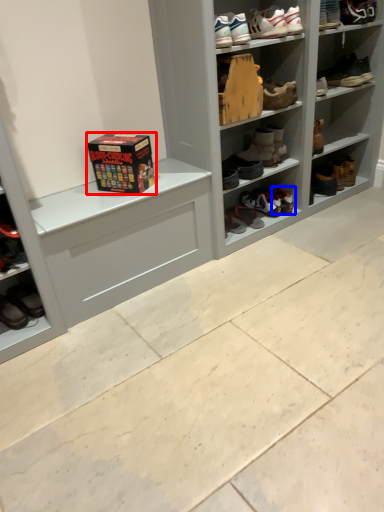
Question: Which object is further to the camera taking this photo, box (highlighted by a red box) or footwear (highlighted by a blue box)?

Choices:
 (A) box
 (B) footwear

Answer: (B)